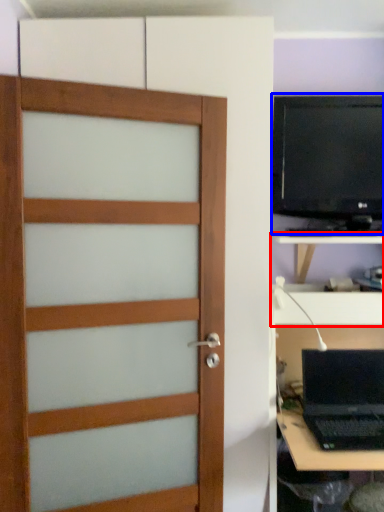
Question: Which point is closer to the camera, tv cabinet (highlighted by a red box) or computer monitor (highlighted by a blue box)?

Choices:
 (A) tv cabinet
 (B) computer monitor

Answer: (A)